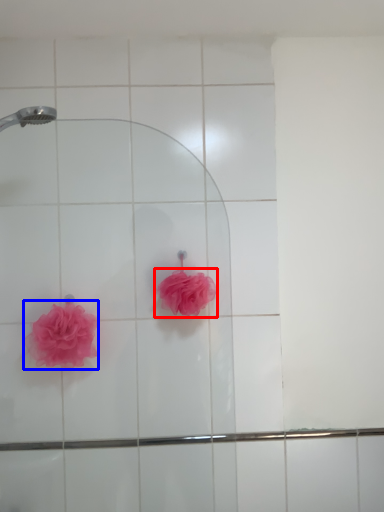
Question: Which object is further to the camera taking this photo, rose (highlighted by a red box) or rose (highlighted by a blue box)?

Choices:
 (A) rose
 (B) rose

Answer: (A)